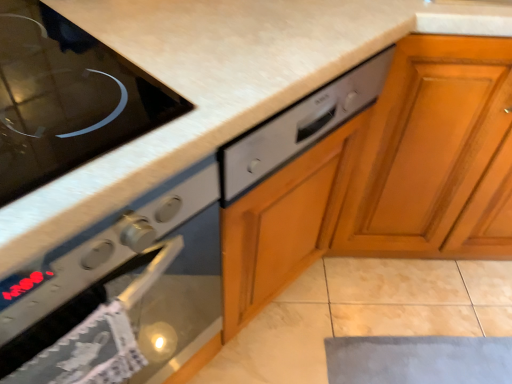
Question: Can you confirm if black glass cooktop at upper left is shorter than wooden cabinet at right?

Choices:
 (A) no
 (B) yes

Answer: (B)

Question: From the image's perspective, would you say black glass cooktop at upper left is positioned over wooden cabinet at right?

Choices:
 (A) yes
 (B) no

Answer: (B)

Question: Is black glass cooktop at upper left closer to camera compared to wooden cabinet at right?

Choices:
 (A) yes
 (B) no

Answer: (A)

Question: Is black glass cooktop at upper left thinner than wooden cabinet at right?

Choices:
 (A) no
 (B) yes

Answer: (B)

Question: Can you confirm if black glass cooktop at upper left is bigger than wooden cabinet at right?

Choices:
 (A) no
 (B) yes

Answer: (A)

Question: Is black glass cooktop at upper left oriented away from wooden cabinet at right?

Choices:
 (A) yes
 (B) no

Answer: (B)

Question: Can you confirm if satin silver dishwasher at center is thinner than black glass cooktop at upper left?

Choices:
 (A) yes
 (B) no

Answer: (A)

Question: From a real-world perspective, is satin silver dishwasher at center on black glass cooktop at upper left?

Choices:
 (A) yes
 (B) no

Answer: (B)

Question: Can you confirm if satin silver dishwasher at center is taller than black glass cooktop at upper left?

Choices:
 (A) yes
 (B) no

Answer: (A)

Question: Is black glass cooktop at upper left surrounded by satin silver dishwasher at center?

Choices:
 (A) no
 (B) yes

Answer: (A)

Question: Is the depth of satin silver dishwasher at center greater than that of black glass cooktop at upper left?

Choices:
 (A) no
 (B) yes

Answer: (B)

Question: Considering the relative positions of satin silver dishwasher at center and black glass cooktop at upper left in the image provided, is satin silver dishwasher at center to the left of black glass cooktop at upper left from the viewer's perspective?

Choices:
 (A) no
 (B) yes

Answer: (A)

Question: Can you confirm if wooden cabinet at right is smaller than satin silver oven at left?

Choices:
 (A) no
 (B) yes

Answer: (A)